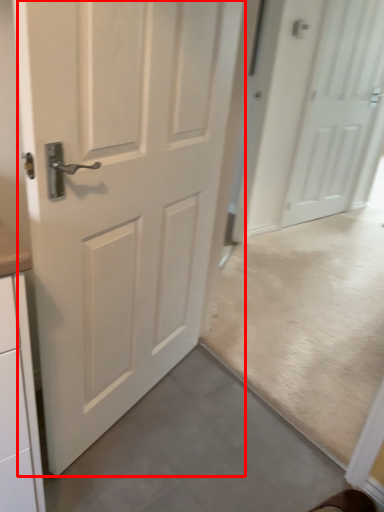
Question: Observing the image, what is the correct spatial positioning of door (annotated by the red box) in reference to door?

Choices:
 (A) right
 (B) left

Answer: (B)